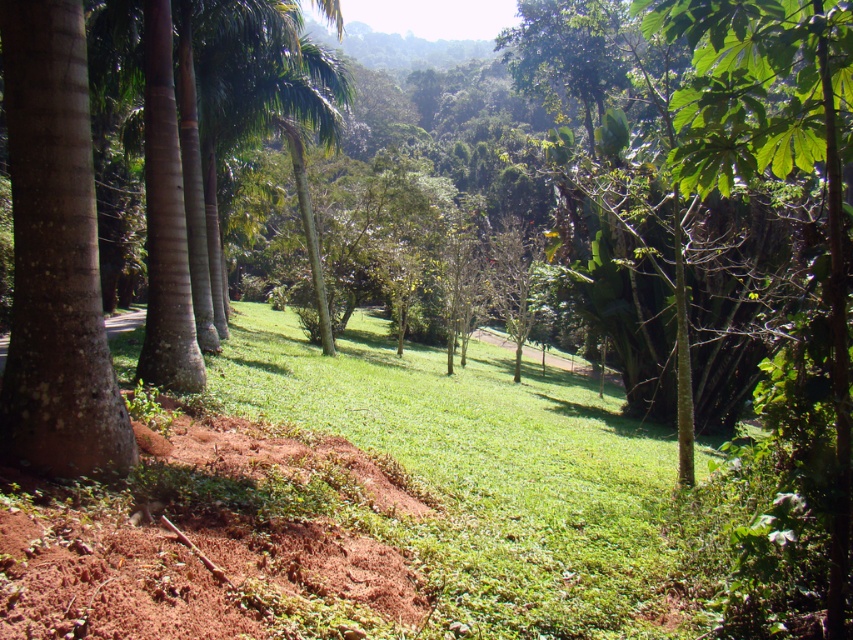
You are planning to set up a picnic area in the image shown. You have a large picnic blanket that is 3 meters wide. You want to place it on the green grassy at center or the smooth brown palm tree at left. Which location can accommodate the blanket without folding it?

The green grassy at center has a width that surpasses the smooth brown palm tree at left, so placing the picnic blanket on the green grassy at center would accommodate the 3 meter width without folding.

From the picture: You are a gardener standing in the middle of the green grassy at center. You want to walk towards the smooth brown palm tree at left. Which direction should you face to walk directly towards it?

You should face towards the left direction because the smooth brown palm tree at left is behind the green grassy at center, so walking towards the left will lead you directly to it.